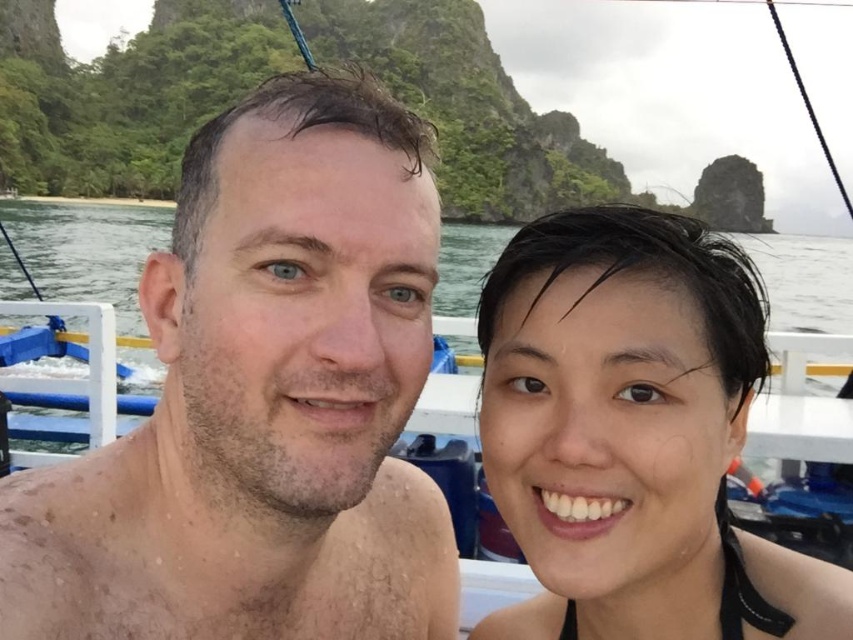
Which is in front, point (225, 112) or point (840, 305)?

Point (225, 112) is in front.

Does dry skin at center lie behind clear blue water at center?

No.

Who is more forward, (231, 380) or (131, 323)?

Positioned in front is point (231, 380).

I want to click on dry skin at center, so click(x=263, y=401).

Between black matte hair at upper right and clear blue water at center, which one appears on the left side from the viewer's perspective?

Positioned to the left is black matte hair at upper right.

Can you confirm if black matte hair at upper right is shorter than clear blue water at center?

Yes.

Measure the distance between black matte hair at upper right and camera.

8.73 feet

At what (x,y) coordinates should I click in order to perform the action: click on black matte hair at upper right. Please return your answer as a coordinate pair (x, y). The width and height of the screenshot is (853, 640). Looking at the image, I should click on (633, 435).

Based on the photo, does dry skin at center have a lesser height compared to black matte hair at upper right?

Incorrect, dry skin at center's height does not fall short of black matte hair at upper right's.

Can you confirm if dry skin at center is positioned to the left of black matte hair at upper right?

Yes, dry skin at center is to the left of black matte hair at upper right.

Does point (100, 472) come behind point (662, 493)?

No, (100, 472) is closer to viewer.

Image resolution: width=853 pixels, height=640 pixels. I want to click on dry skin at center, so click(263, 401).